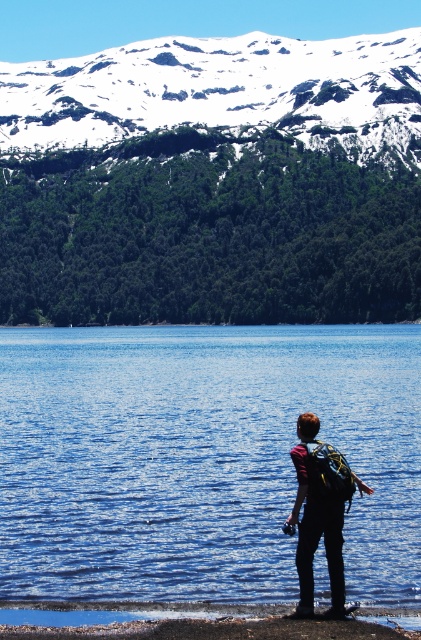
You are standing at the point marked as point (200, 458) in the image. What do you see directly below you?

Result: At point (200, 458) lies blue liquid water at lower center.

You are standing at the edge of the smooth sand shoreline at lower center and want to place your matte black backpack at center so it won not get wet. Is the shoreline wide enough to place it there?

The smooth sand shoreline at lower center might be wider than matte black backpack at center, so it is possible that the shoreline is wide enough to place the backpack safely away from the water.